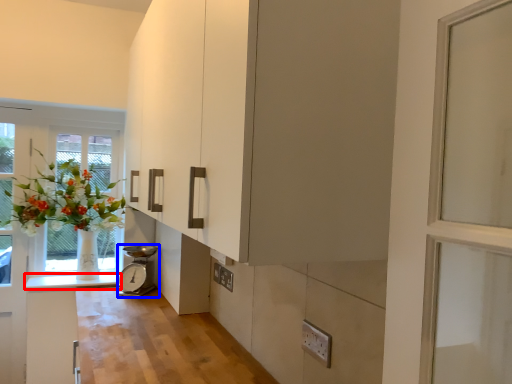
Question: Which point is closer to the camera, counter top (highlighted by a red box) or appliance (highlighted by a blue box)?

Choices:
 (A) counter top
 (B) appliance

Answer: (B)